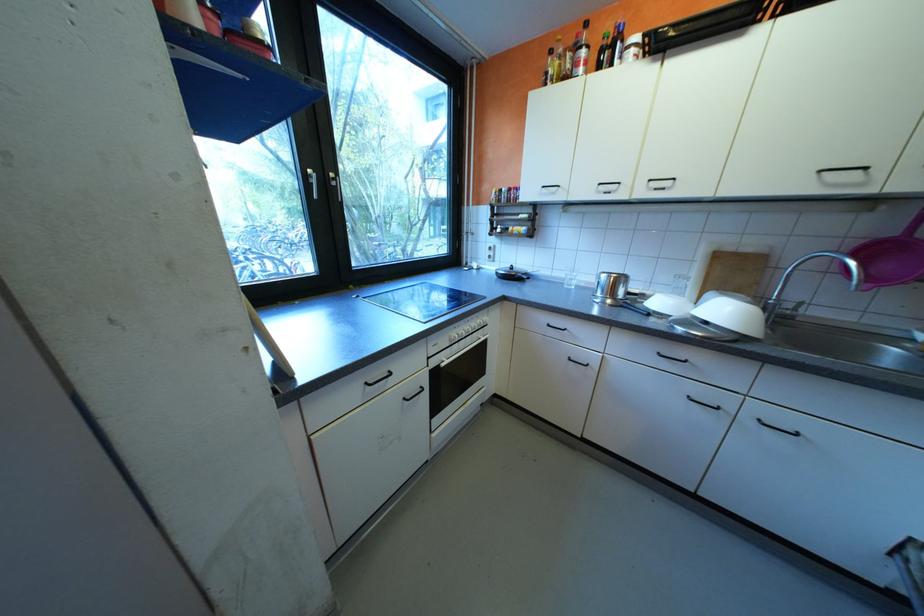
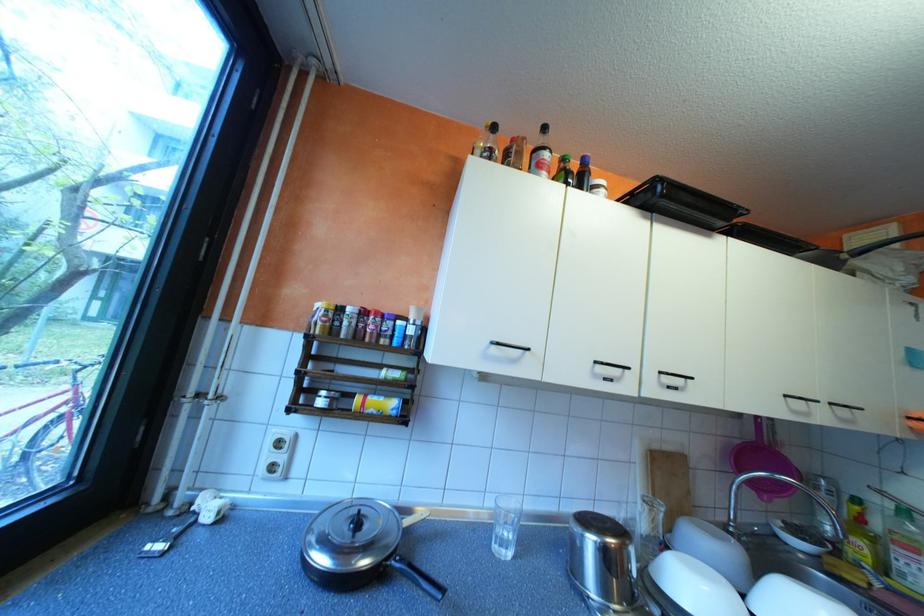
In the second image, find the point that corresponds to the point at 661,188 in the first image.

(673, 383)